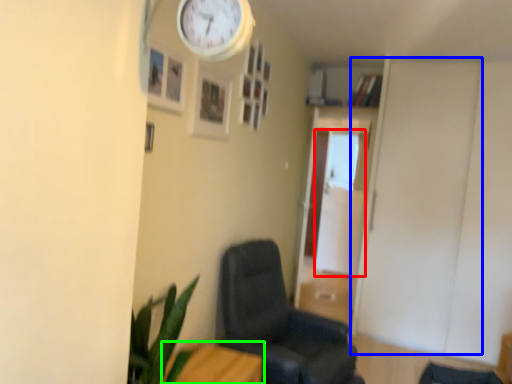
Question: Which object is positioned closest to glass door (highlighted by a red box)? Select from door (highlighted by a blue box) and furniture (highlighted by a green box).

Choices:
 (A) door
 (B) furniture

Answer: (A)